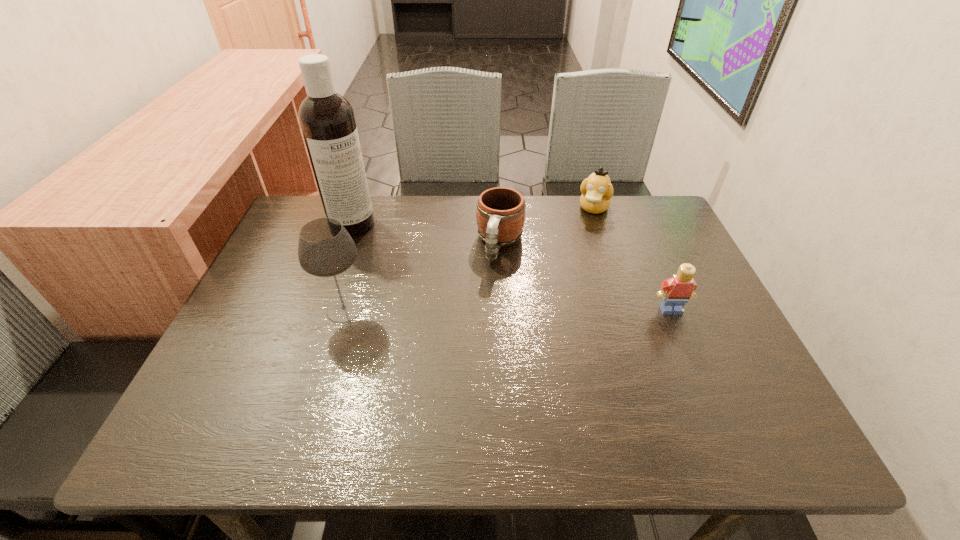
Locate an element on the screen. vacant spot on the desktop that is between the second tallest object and the rightmost object and is positioned on the label side of the dishwasher detergent is located at coordinates (468, 310).

Locate an element on the screen. This screenshot has width=960, height=540. vacant space on the desktop that is between the wineglass and the Lego and is positioned on the side of the third object from left to right with the handle is located at coordinates (480, 310).

This screenshot has height=540, width=960. I want to click on vacant space on the desktop that is between the wineglass and the Lego and is positioned on the face of the duckling, so click(x=550, y=310).